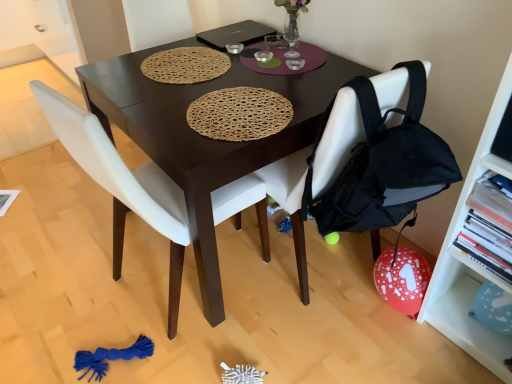
This screenshot has height=384, width=512. What are the coordinates of `free region on the left part of dark wood table at center` in the screenshot? It's located at click(62, 252).